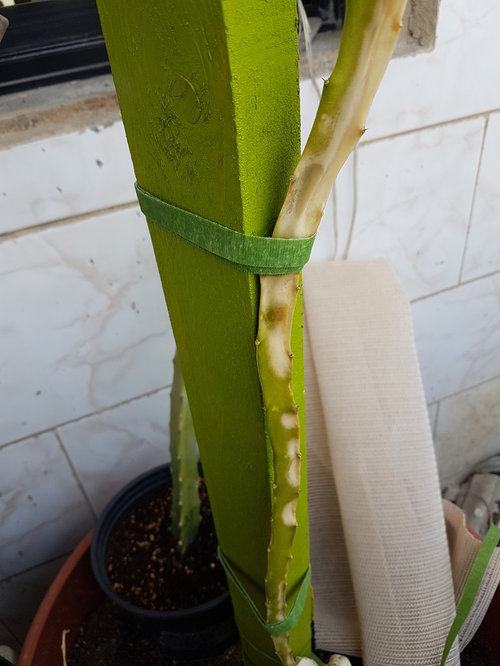
At what (x,y) coordinates should I click in order to perform the action: click on 1 windowsill. Please return your answer as a coordinate pair (x, y). The image size is (500, 666). Looking at the image, I should click on (63, 58).